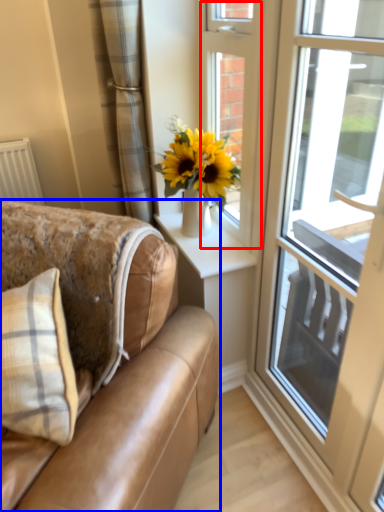
Question: Which point is closer to the camera, door (highlighted by a red box) or studio couch (highlighted by a blue box)?

Choices:
 (A) door
 (B) studio couch

Answer: (B)